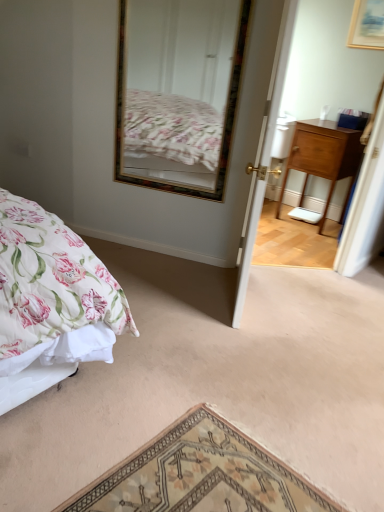
You are a GUI agent. You are given a task and a screenshot of the screen. Output one action in this format:
    pyautogui.click(x=<x>, y=<y>)
    Task: Click on the free region under white wooden door at center (from a real-world perspective)
    The width and height of the screenshot is (384, 512).
    Given the screenshot: What is the action you would take?
    [249, 298]